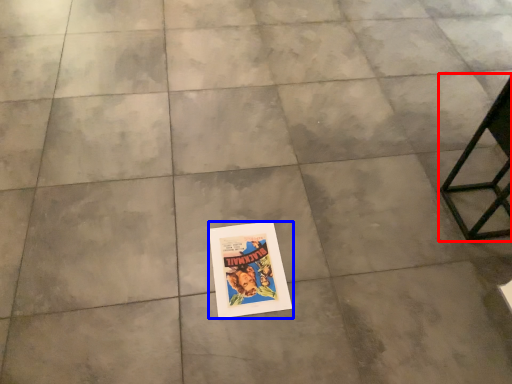
Question: Among these objects, which one is farthest to the camera, furniture (highlighted by a red box) or poster (highlighted by a blue box)?

Choices:
 (A) furniture
 (B) poster

Answer: (B)